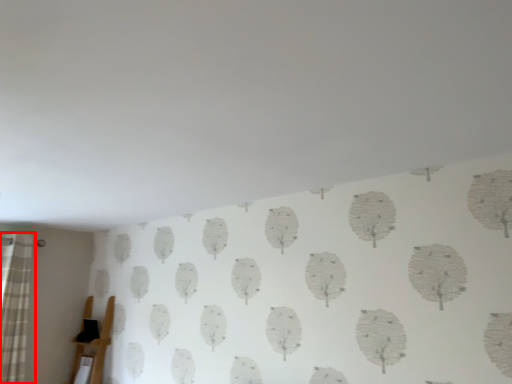
Question: From the image, what is the correct spatial relationship of curtain (annotated by the red box) in relation to furniture?

Choices:
 (A) left
 (B) right

Answer: (A)